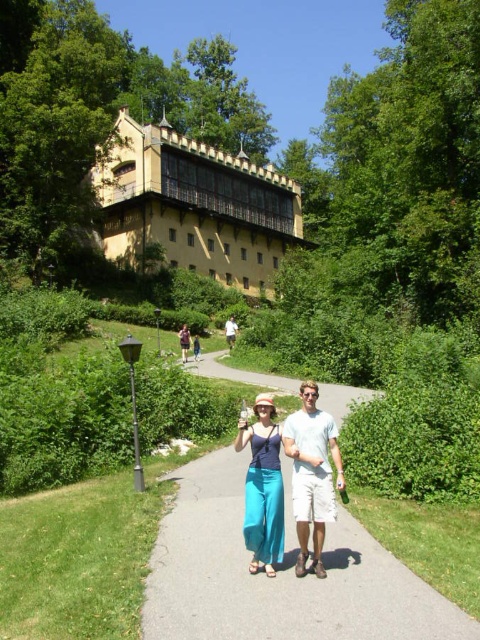
Question: Which point is closer to the camera taking this photo?

Choices:
 (A) (276, 440)
 (B) (226, 339)

Answer: (A)

Question: Is gray concrete pavement at center wider than white cotton shorts at center?

Choices:
 (A) yes
 (B) no

Answer: (A)

Question: Can you confirm if yellow matte building at upper center is bigger than white cotton shorts at center?

Choices:
 (A) yes
 (B) no

Answer: (A)

Question: Which point is closer to the camera taking this photo?

Choices:
 (A) (273, 506)
 (B) (226, 333)

Answer: (A)

Question: Does gray concrete pavement at center appear on the left side of matte blue pants at center?

Choices:
 (A) no
 (B) yes

Answer: (A)

Question: Which of the following is the closest to the observer?

Choices:
 (A) matte blue pants at center
 (B) white cotton shirt at center
 (C) yellow matte building at upper center
 (D) gray concrete pavement at center

Answer: (D)